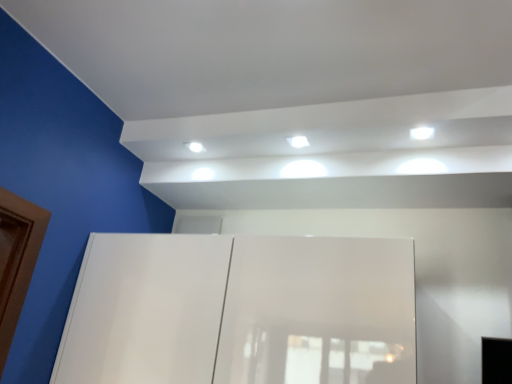
Question: Does white glossy light at upper right, which is the first light from front to back, have a greater height compared to white glossy light fixture at upper center?

Choices:
 (A) yes
 (B) no

Answer: (B)

Question: Is the depth of white glossy light at upper right, the 1th light from the right, less than that of white glossy light fixture at upper center?

Choices:
 (A) no
 (B) yes

Answer: (B)

Question: From a real-world perspective, is white glossy light at upper right, acting as the second light starting from the back, under white glossy light fixture at upper center?

Choices:
 (A) no
 (B) yes

Answer: (A)

Question: From the image's perspective, is white glossy light at upper right, the 1th light from the right, under white glossy light fixture at upper center?

Choices:
 (A) yes
 (B) no

Answer: (B)

Question: Is white glossy light at upper right, the 1th light from the right, positioned beyond the bounds of white glossy light fixture at upper center?

Choices:
 (A) yes
 (B) no

Answer: (A)

Question: From a real-world perspective, is white glossy light at upper right, the 1th light from the right, on white glossy light fixture at upper center?

Choices:
 (A) yes
 (B) no

Answer: (A)

Question: Considering the relative sizes of white glossy light fixture at upper center and white glossy light at center, which is counted as the second light, starting from the right, in the image provided, is white glossy light fixture at upper center shorter than white glossy light at center, which is counted as the second light, starting from the right,?

Choices:
 (A) no
 (B) yes

Answer: (B)

Question: Is white glossy light fixture at upper center thinner than white glossy light at center, arranged as the 1th light when viewed from the back?

Choices:
 (A) no
 (B) yes

Answer: (B)

Question: Is white glossy light fixture at upper center directly adjacent to white glossy light at center, placed as the second light when sorted from front to back?

Choices:
 (A) no
 (B) yes

Answer: (A)

Question: Is white glossy light fixture at upper center facing away from white glossy light at center, placed as the second light when sorted from front to back?

Choices:
 (A) no
 (B) yes

Answer: (A)

Question: Is white glossy light fixture at upper center at the left side of white glossy light at center, placed as the second light when sorted from front to back?

Choices:
 (A) no
 (B) yes

Answer: (B)

Question: From the image's perspective, does white glossy light fixture at upper center appear lower than white glossy light at center, which is counted as the second light, starting from the right?

Choices:
 (A) yes
 (B) no

Answer: (A)

Question: Is the depth of white glossy light at center, which is counted as the second light, starting from the right, greater than that of white glossy light at upper right, which is the first light from front to back?

Choices:
 (A) yes
 (B) no

Answer: (A)